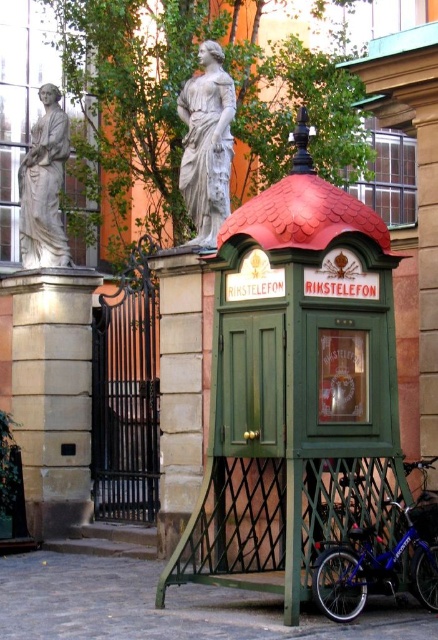
Question: Can you confirm if blue metallic bicycle at lower right is thinner than white marble statue at left?

Choices:
 (A) yes
 (B) no

Answer: (A)

Question: Which point is farther to the camera?

Choices:
 (A) green wood telephone booth at center
 (B) white marble statue at upper center
 (C) blue metallic bicycle at lower right

Answer: (B)

Question: In this image, where is green wood telephone booth at center located relative to blue metallic bicycle at lower right?

Choices:
 (A) left
 (B) right

Answer: (A)

Question: Can you confirm if green wood telephone booth at center is positioned above white marble statue at left?

Choices:
 (A) yes
 (B) no

Answer: (B)

Question: Which of the following is the closest to the observer?

Choices:
 (A) white marble statue at left
 (B) green wood telephone booth at center
 (C) white marble statue at upper center

Answer: (B)

Question: Among these points, which one is farthest from the camera?

Choices:
 (A) (235, 339)
 (B) (395, 564)
 (C) (32, 204)

Answer: (C)